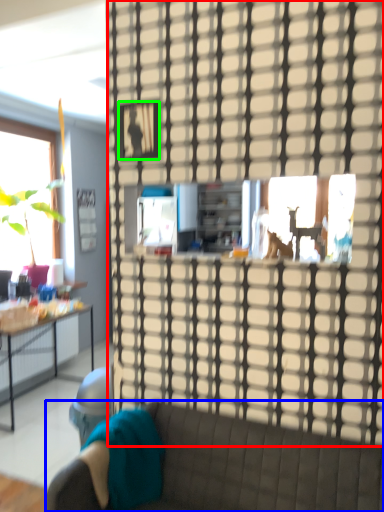
Question: Estimate the real-world distances between objects in this image. Which object is farther from glass door (highlighted by a red box), studio couch (highlighted by a blue box) or picture frame (highlighted by a green box)?

Choices:
 (A) studio couch
 (B) picture frame

Answer: (A)